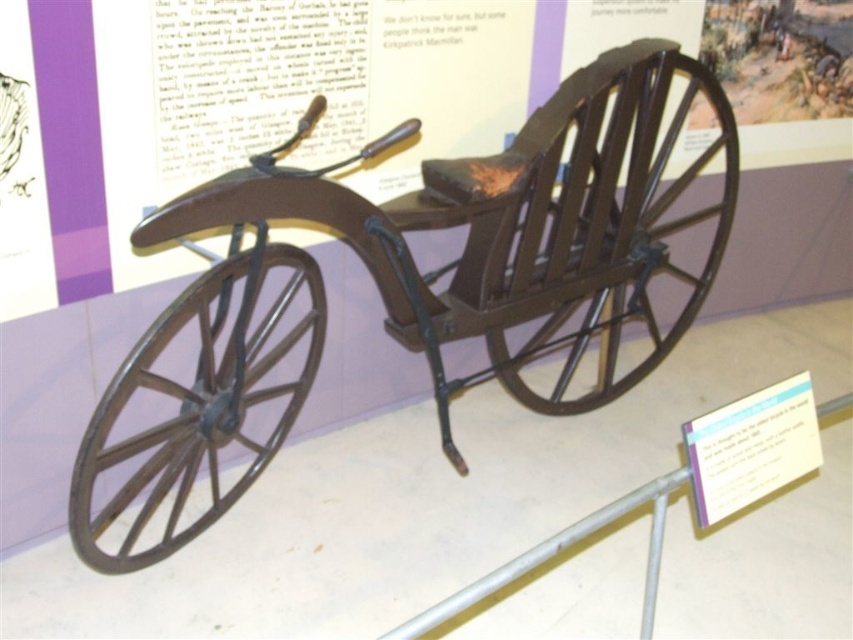
Is dark brown wood wagon at center further to the viewer compared to rusty metal wheel at left?

No, dark brown wood wagon at center is closer to the viewer.

Between dark brown wood wagon at center and rusty metal wheel at left, which one appears on the left side from the viewer's perspective?

From the viewer's perspective, rusty metal wheel at left appears more on the left side.

Measure the distance between point (650, 358) and camera.

Point (650, 358) and camera are 2.89 meters apart.

Where is `dark brown wood wagon at center`? dark brown wood wagon at center is located at coordinates (410, 291).

How far apart are rusty metal wheel at left and dark brown wood wheel at center?

rusty metal wheel at left and dark brown wood wheel at center are 37.78 inches apart.

Is rusty metal wheel at left behind dark brown wood wheel at center?

No, it is not.

Does point (102, 442) come behind point (637, 141)?

No, (102, 442) is closer to viewer.

You are a GUI agent. You are given a task and a screenshot of the screen. Output one action in this format:
    pyautogui.click(x=<x>, y=<y>)
    Task: Click on the rusty metal wheel at left
    The image size is (853, 640).
    Given the screenshot: What is the action you would take?
    pyautogui.click(x=196, y=404)

Is dark brown wood wagon at center smaller than dark brown wood wheel at center?

No, dark brown wood wagon at center is not smaller than dark brown wood wheel at center.

Which of these two, dark brown wood wagon at center or dark brown wood wheel at center, stands shorter?

dark brown wood wheel at center

Is point (183, 518) positioned before point (523, 396)?

Yes, point (183, 518) is in front of point (523, 396).

This screenshot has height=640, width=853. What are the coordinates of `dark brown wood wagon at center` in the screenshot? It's located at (410, 291).